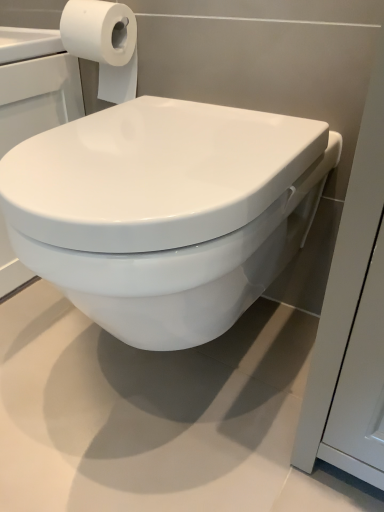
Question: Looking at the image, does white matte toilet paper at upper left seem bigger or smaller compared to white glossy toilet at center?

Choices:
 (A) small
 (B) big

Answer: (A)

Question: Is point (134, 51) closer or farther from the camera than point (122, 198)?

Choices:
 (A) farther
 (B) closer

Answer: (A)

Question: From a real-world perspective, is white matte toilet paper at upper left positioned above or below white glossy toilet at center?

Choices:
 (A) above
 (B) below

Answer: (A)

Question: Is white glossy toilet at center taller or shorter than white matte toilet paper at upper left?

Choices:
 (A) short
 (B) tall

Answer: (B)

Question: Is point (289, 242) closer or farther from the camera than point (110, 34)?

Choices:
 (A) closer
 (B) farther

Answer: (B)

Question: Is white glossy toilet at center to the left or to the right of white matte toilet paper at upper left in the image?

Choices:
 (A) left
 (B) right

Answer: (B)

Question: Is white glossy toilet at center wider or thinner than white matte toilet paper at upper left?

Choices:
 (A) thin
 (B) wide

Answer: (B)